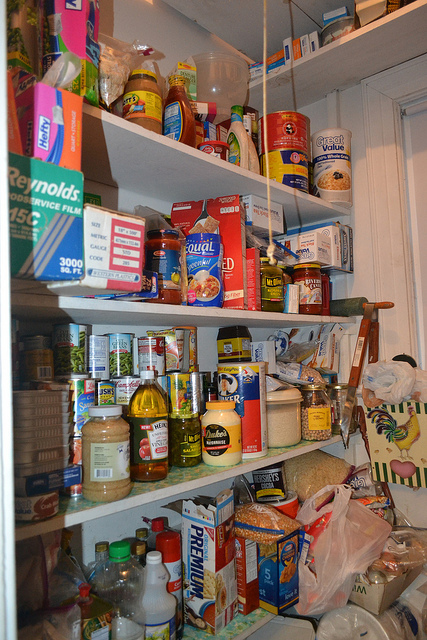
The height and width of the screenshot is (640, 427). I want to click on door, so click(374, 154).